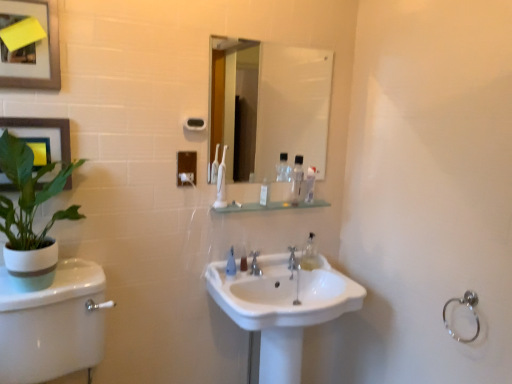
At what (x,y) coordinates should I click in order to perform the action: click on vacant area on top of transparent glass shelf at center (from a real-world perspective). Please return your answer as a coordinate pair (x, y). Image resolution: width=512 pixels, height=384 pixels. Looking at the image, I should click on (277, 208).